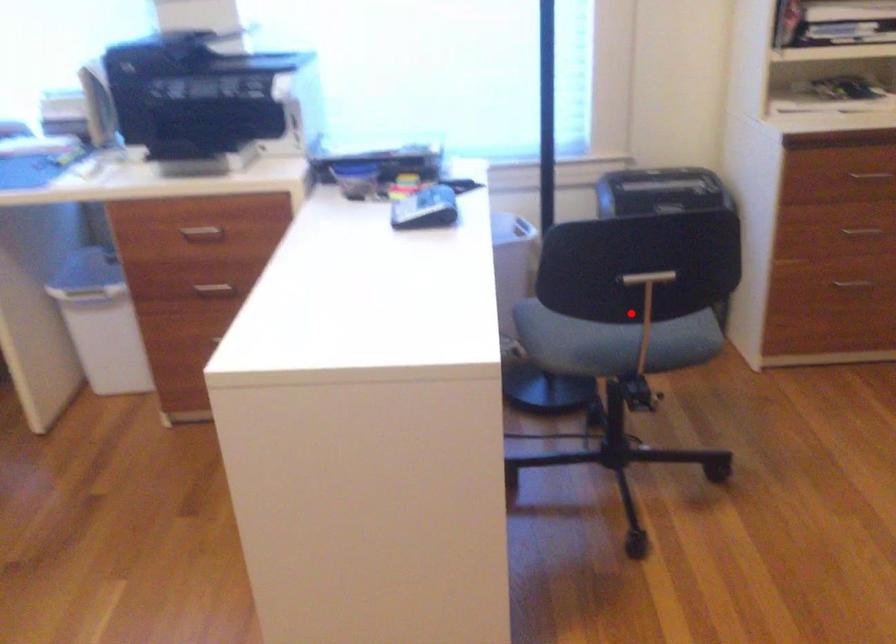
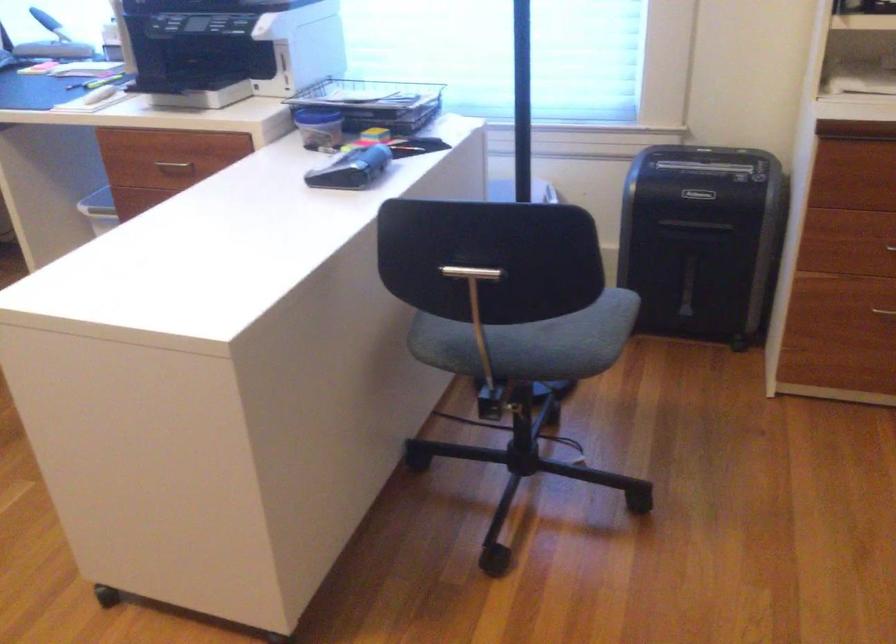
Find the pixel in the second image that matches the highlighted location in the first image.

(476, 308)